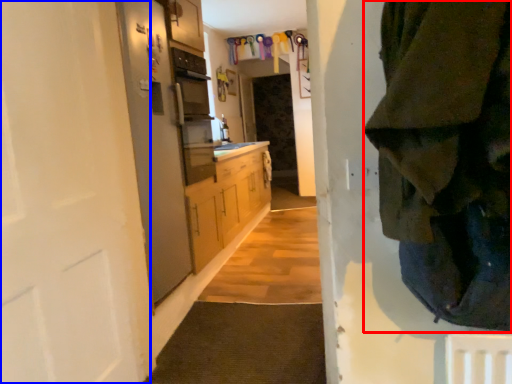
Question: Which object is closer to the camera taking this photo, clothing (highlighted by a red box) or door (highlighted by a blue box)?

Choices:
 (A) clothing
 (B) door

Answer: (A)